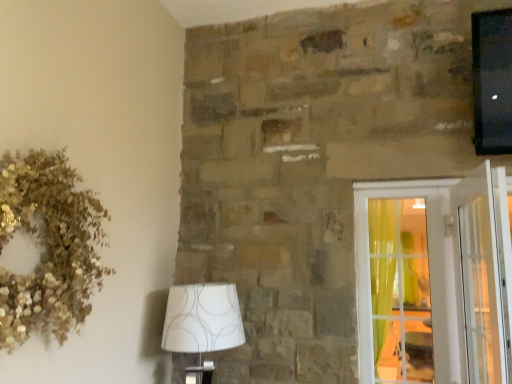
Question: Can you confirm if clear glass door at right is positioned to the left of white fabric lampshade at lower left?

Choices:
 (A) no
 (B) yes

Answer: (A)

Question: Considering the relative sizes of clear glass door at right and white fabric lampshade at lower left in the image provided, is clear glass door at right wider than white fabric lampshade at lower left?

Choices:
 (A) yes
 (B) no

Answer: (B)

Question: Is clear glass door at right closer to camera compared to white fabric lampshade at lower left?

Choices:
 (A) no
 (B) yes

Answer: (A)

Question: From the image's perspective, is clear glass door at right below white fabric lampshade at lower left?

Choices:
 (A) no
 (B) yes

Answer: (A)

Question: Could you tell me if clear glass door at right is turned towards white fabric lampshade at lower left?

Choices:
 (A) no
 (B) yes

Answer: (A)

Question: Considering the positions of clear glass screen door at right and gold glitter wreath at upper left in the image, is clear glass screen door at right taller or shorter than gold glitter wreath at upper left?

Choices:
 (A) short
 (B) tall

Answer: (B)

Question: Considering the positions of clear glass screen door at right and gold glitter wreath at upper left in the image, is clear glass screen door at right wider or thinner than gold glitter wreath at upper left?

Choices:
 (A) thin
 (B) wide

Answer: (A)

Question: Looking at the image, does clear glass screen door at right seem bigger or smaller compared to gold glitter wreath at upper left?

Choices:
 (A) small
 (B) big

Answer: (B)

Question: Choose the correct answer: Is clear glass screen door at right inside gold glitter wreath at upper left or outside it?

Choices:
 (A) inside
 (B) outside

Answer: (B)

Question: Is point (463, 324) closer or farther from the camera than point (223, 304)?

Choices:
 (A) closer
 (B) farther

Answer: (B)

Question: Looking at their shapes, would you say clear glass door at right is wider or thinner than white fabric lampshade at lower left?

Choices:
 (A) thin
 (B) wide

Answer: (A)

Question: Relative to white fabric lampshade at lower left, is clear glass door at right in front or behind?

Choices:
 (A) front
 (B) behind

Answer: (B)

Question: Would you say clear glass door at right is to the left or to the right of white fabric lampshade at lower left in the picture?

Choices:
 (A) left
 (B) right

Answer: (B)

Question: Is gold glitter wreath at upper left to the left or to the right of clear glass door at right in the image?

Choices:
 (A) left
 (B) right

Answer: (A)

Question: From a real-world perspective, is gold glitter wreath at upper left physically located above or below clear glass door at right?

Choices:
 (A) below
 (B) above

Answer: (B)